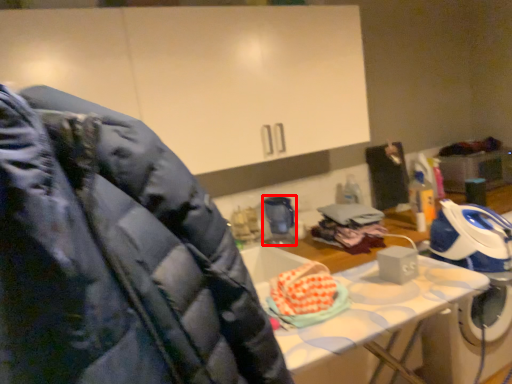
Question: Observing the image, what is the correct spatial positioning of appliance (annotated by the red box) in reference to person?

Choices:
 (A) left
 (B) right

Answer: (A)